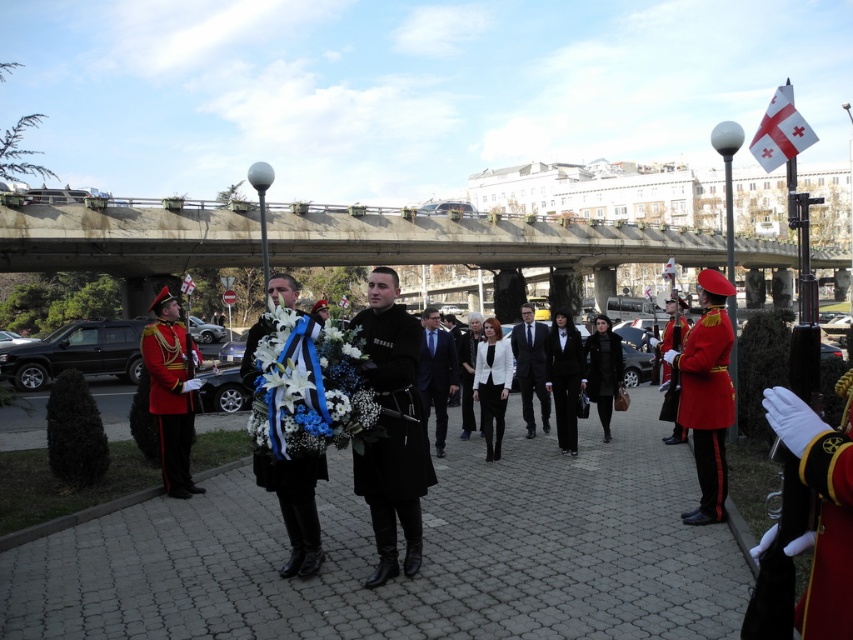
Who is positioned more to the right, black matte coat at center or dark suit at center?

Positioned to the right is dark suit at center.

At what (x,y) coordinates should I click in order to perform the action: click on black matte coat at center. Please return your answer as a coordinate pair (x, y). This screenshot has width=853, height=640. Looking at the image, I should click on (393, 429).

Does dark suit at center appear under black leather jacket at center?

Indeed, dark suit at center is positioned under black leather jacket at center.

Is dark suit at center bigger than black leather jacket at center?

Yes.

Is point (445, 429) farther from camera compared to point (467, 330)?

No, (445, 429) is in front of (467, 330).

I want to click on dark suit at center, so click(436, 372).

Which of these two, black matte coat at center or shiny red uniform at left, stands shorter?

Standing shorter between the two is shiny red uniform at left.

Which is behind, point (434, 481) or point (170, 381)?

The point (170, 381) is more distant.

Who is more forward, (369, 378) or (173, 481)?

Point (369, 378)

Find the location of a particular element. The width and height of the screenshot is (853, 640). black matte coat at center is located at coordinates (393, 429).